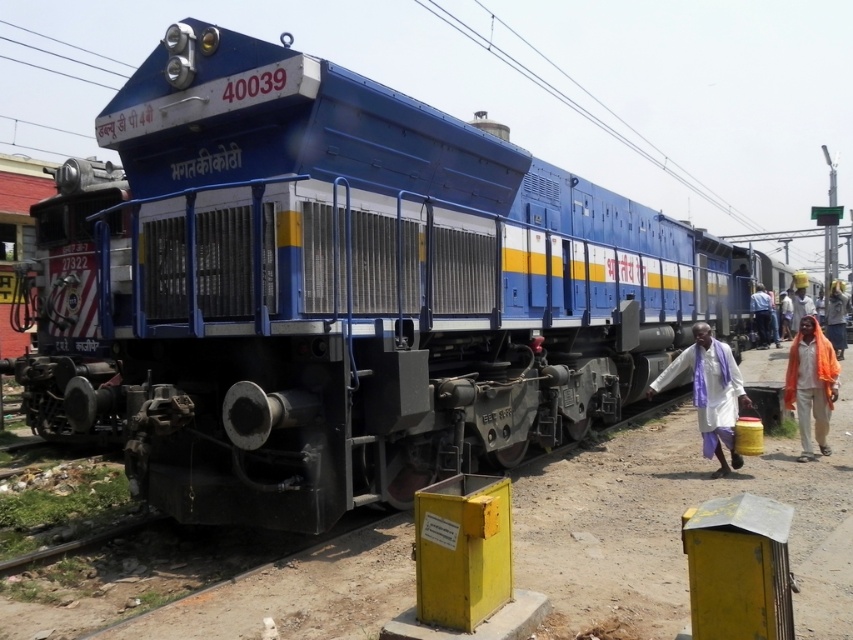
Question: Among these objects, which one is farthest from the camera?

Choices:
 (A) white cotton cloth at lower right
 (B) orange fabric headscarf at right
 (C) white cloth at right

Answer: (C)

Question: Observing the image, what is the correct spatial positioning of orange fabric headscarf at right in reference to white cloth at right?

Choices:
 (A) below
 (B) above

Answer: (A)

Question: Which object is the farthest from the orange fabric cloth at right?

Choices:
 (A) white cotton cloth at lower right
 (B) orange fabric headscarf at right
 (C) white cloth at center
 (D) white cloth at right

Answer: (A)

Question: Can you confirm if white cotton cloth at lower right is positioned to the right of white cloth at center?

Choices:
 (A) no
 (B) yes

Answer: (A)

Question: Is orange cloth at right thinner than white cloth at right?

Choices:
 (A) yes
 (B) no

Answer: (A)

Question: Which is farther from the white cloth at center?

Choices:
 (A) orange fabric headscarf at right
 (B) orange cloth at right
 (C) white cotton cloth at lower right

Answer: (C)